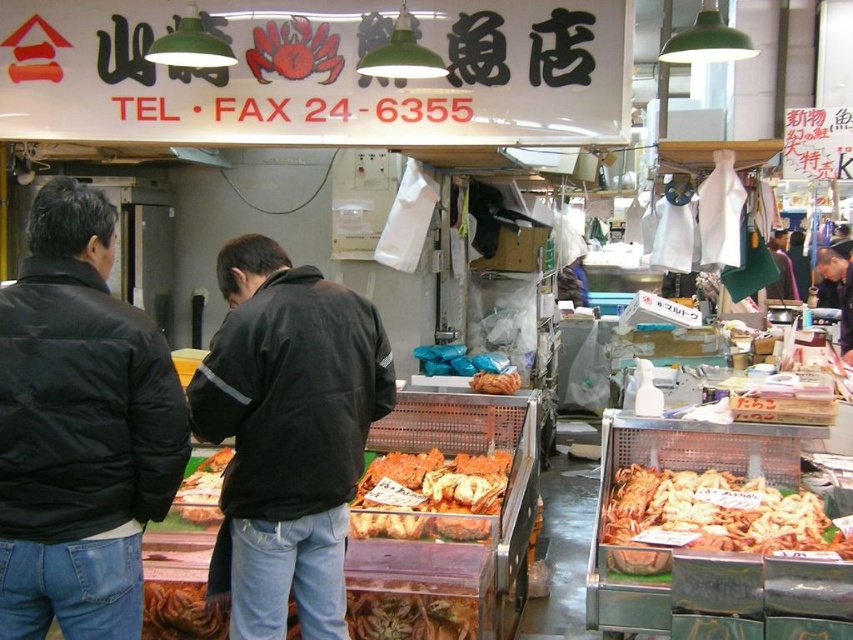
Question: Does shiny brown shrimp at center have a smaller size compared to brown crispy bread at center?

Choices:
 (A) no
 (B) yes

Answer: (A)

Question: Is golden crispy shrimp at center thinner than shiny plastic tray at center?

Choices:
 (A) no
 (B) yes

Answer: (A)

Question: Which point is farther to the camera?

Choices:
 (A) (210, 464)
 (B) (253, 538)
 (C) (836, 301)

Answer: (C)

Question: Can you confirm if black leather jacket at center is bigger than brown crispy bread at center?

Choices:
 (A) yes
 (B) no

Answer: (A)

Question: Considering the real-world distances, which object is farthest from the shiny golden prawns at center?

Choices:
 (A) shiny brown shrimp at center
 (B) dark gray jacket at center
 (C) shiny plastic tray at center
 (D) golden crispy shrimp at center

Answer: (B)

Question: Which point is closer to the camera taking this photo?

Choices:
 (A) (509, 380)
 (B) (843, 554)
 (C) (836, 253)

Answer: (B)